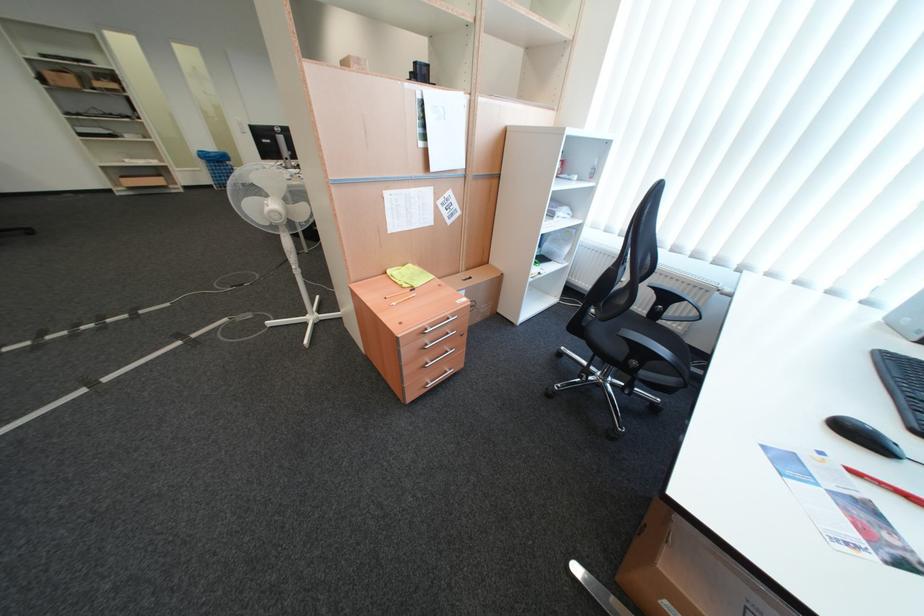
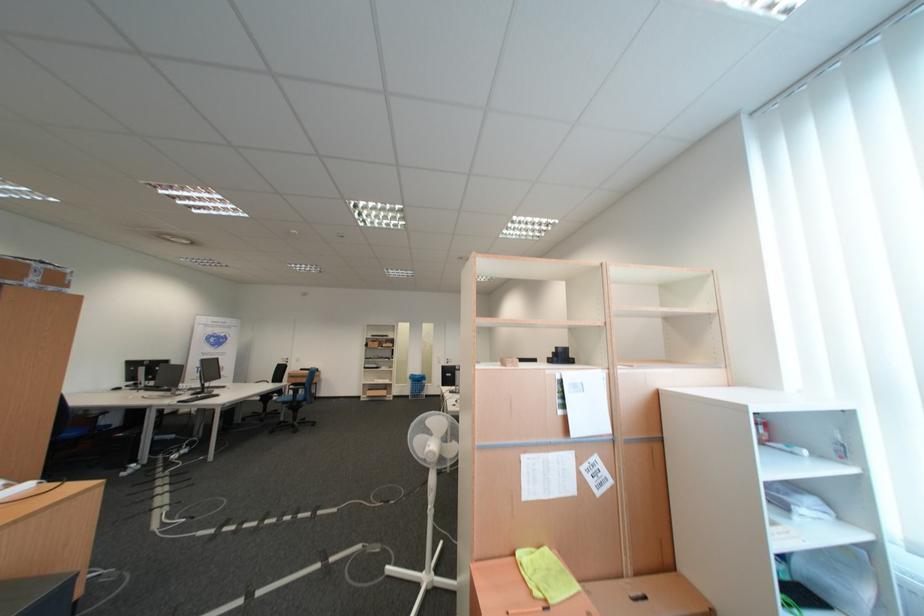
The point at (323, 318) is marked in the first image. Where is the corresponding point in the second image?

(439, 578)